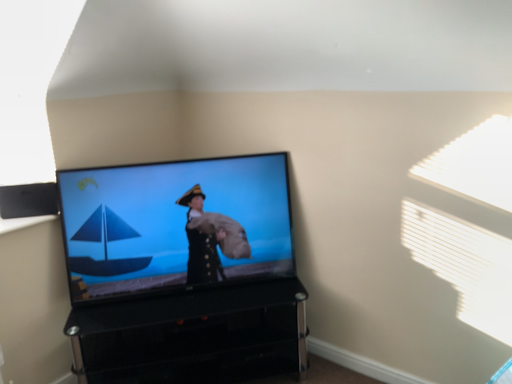
Locate an element on the screen. vacant space underneath matte black tv at center (from a real-world perspective) is located at coordinates (205, 288).